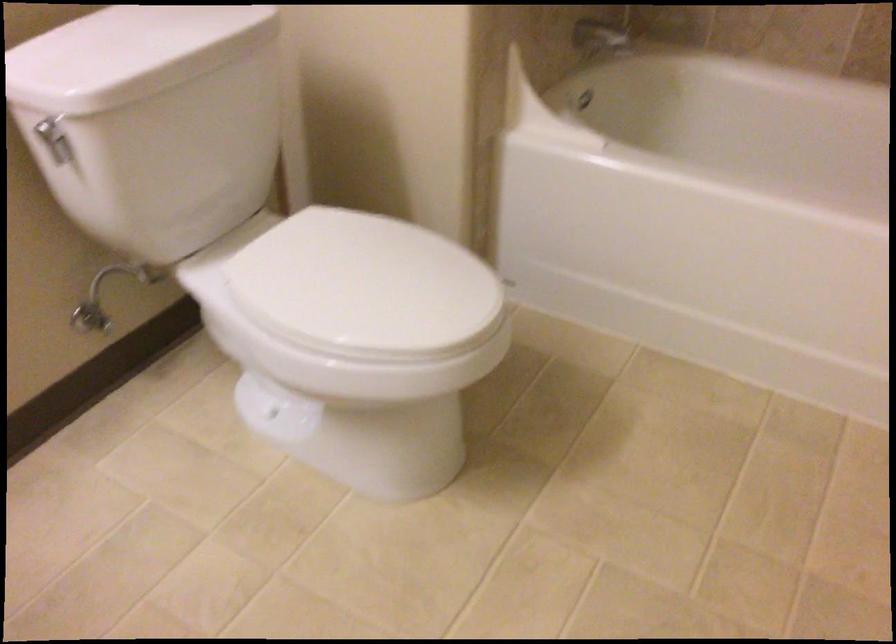
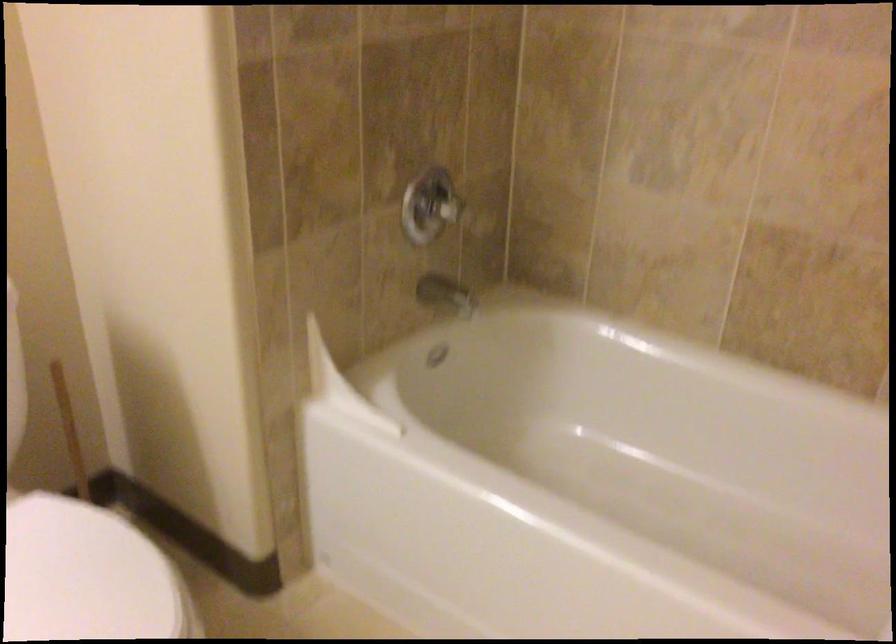
Question: The images are taken continuously from a first-person perspective. In which direction are you moving?

Choices:
 (A) Left
 (B) Right
 (C) Forward
 (D) Backward

Answer: (B)